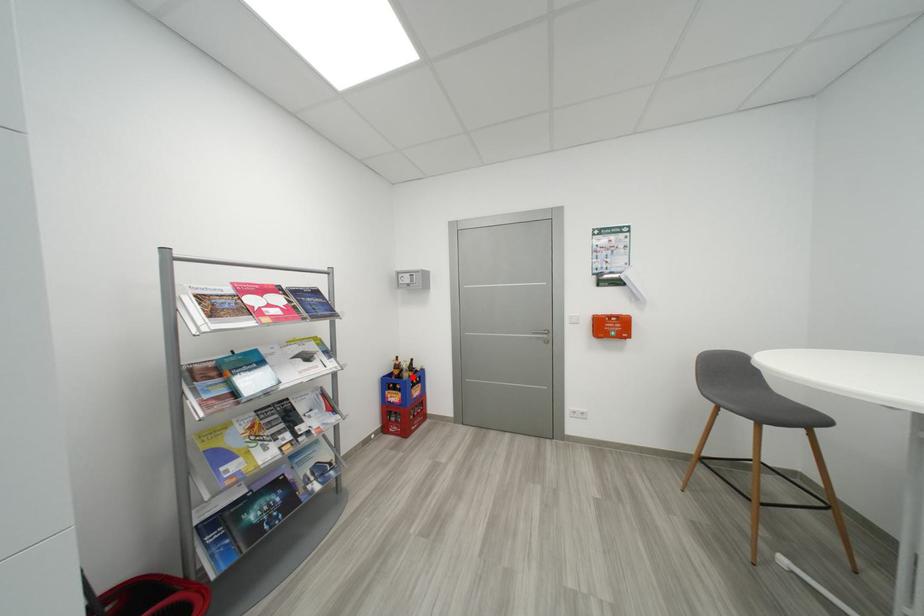
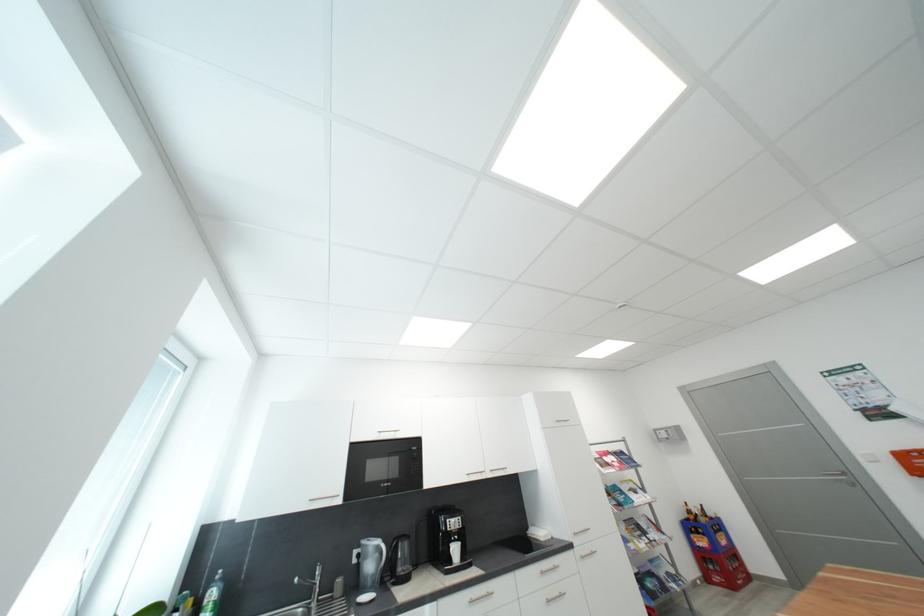
Question: I am providing you with two images of the same scene from different viewpoints. A red point is shown in image1. For the corresponding object point in image2, is it positioned nearer or farther from the camera?

Choices:
 (A) Nearer
 (B) Farther

Answer: (A)